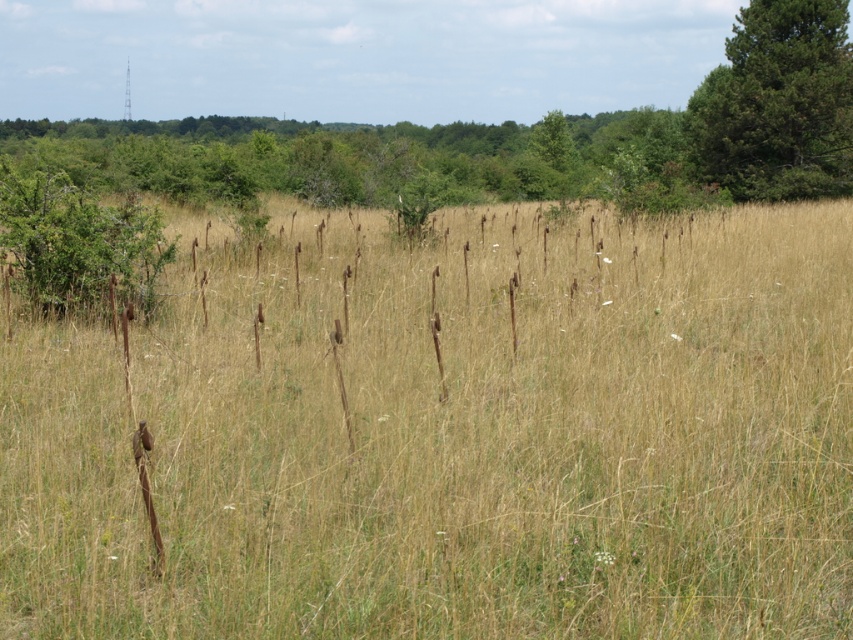
Question: Which of the following is the closest to the observer?

Choices:
 (A) green textured pine tree at upper right
 (B) dry grass at center

Answer: (B)

Question: Is dry grass at center below green textured pine tree at upper right?

Choices:
 (A) yes
 (B) no

Answer: (A)

Question: Where is dry grass at center located in relation to green textured pine tree at upper right in the image?

Choices:
 (A) left
 (B) right

Answer: (A)

Question: Does dry grass at center have a greater width compared to green textured pine tree at upper right?

Choices:
 (A) no
 (B) yes

Answer: (B)

Question: Which of the following is the farthest from the observer?

Choices:
 (A) green textured pine tree at upper right
 (B) dry grass at center

Answer: (A)